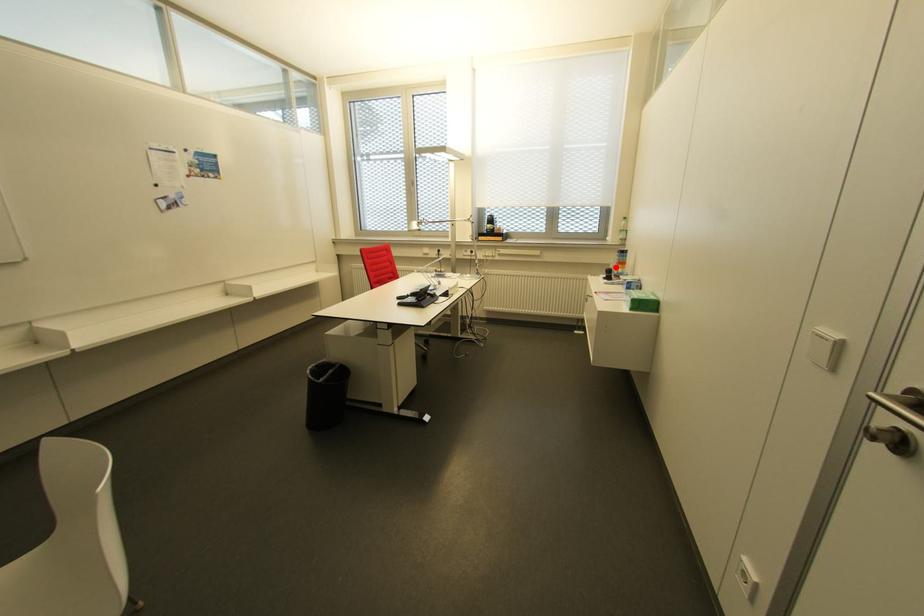
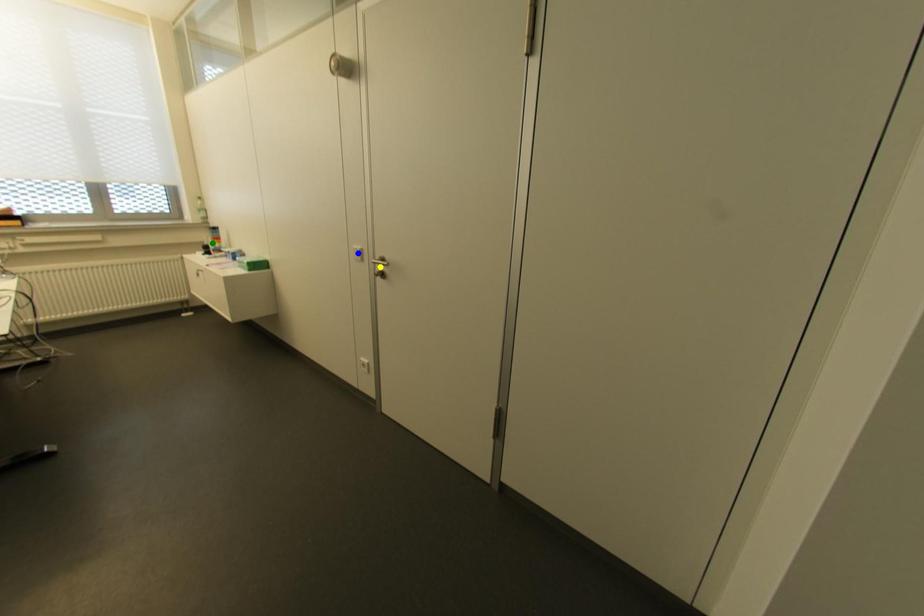
Question: I am providing you with two images of the same scene from different viewpoints. A red point is marked on the first image. You are given multiple points on the second image. Can you choose the point in image 2 that corresponds to the point in image 1?

Choices:
 (A) yellow point
 (B) green point
 (C) blue point

Answer: (B)